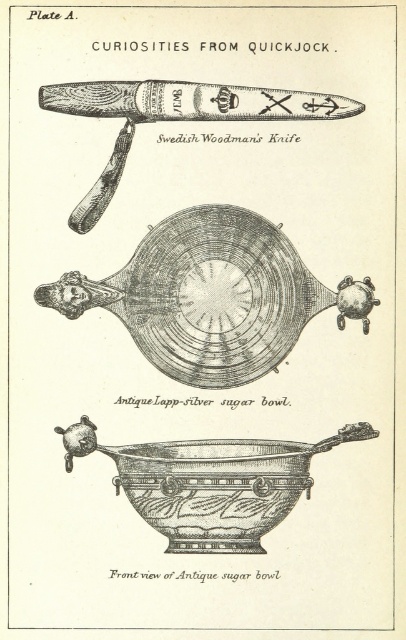
You are an antique collector examining the items in Plate A. You need to place the black polished silver bowl at center and the antique silver sugar bowl at center on a shelf. Which one should you place first to ensure they are arranged according to their positions in the original illustration?

The black polished silver bowl at center should be placed first to the left of the antique silver sugar bowl at center, as it is positioned to the left in the original illustration.